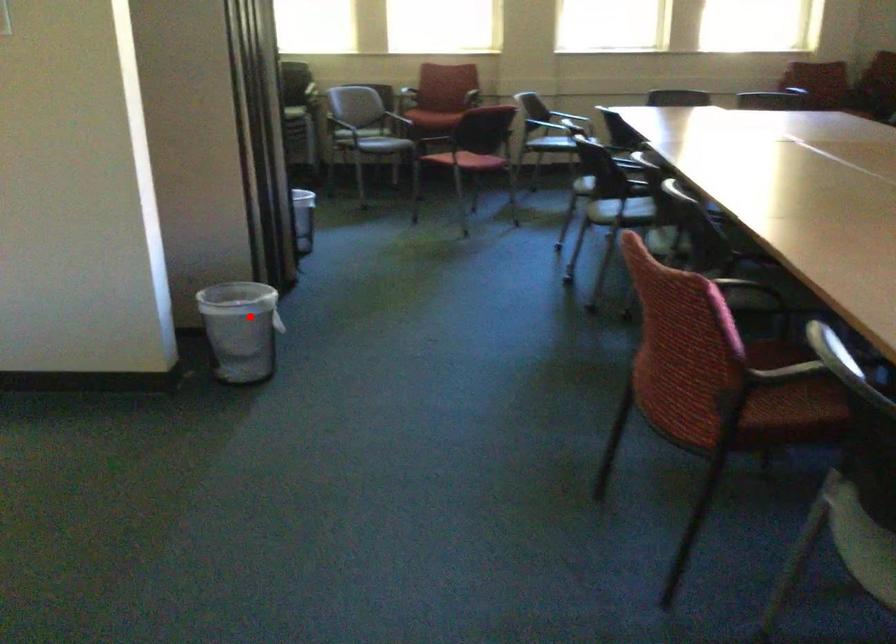
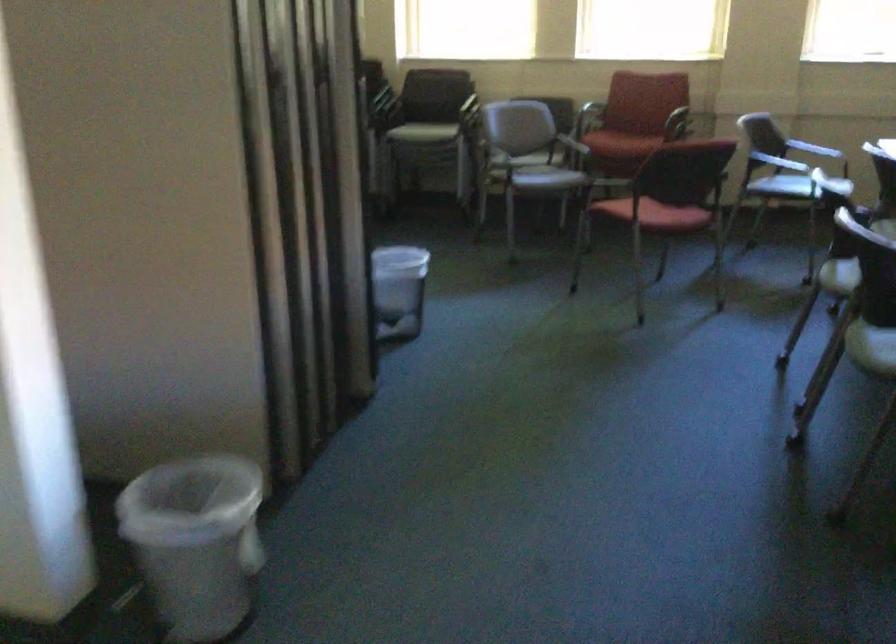
The point at the highlighted location is marked in the first image. Where is the corresponding point in the second image?

(195, 542)